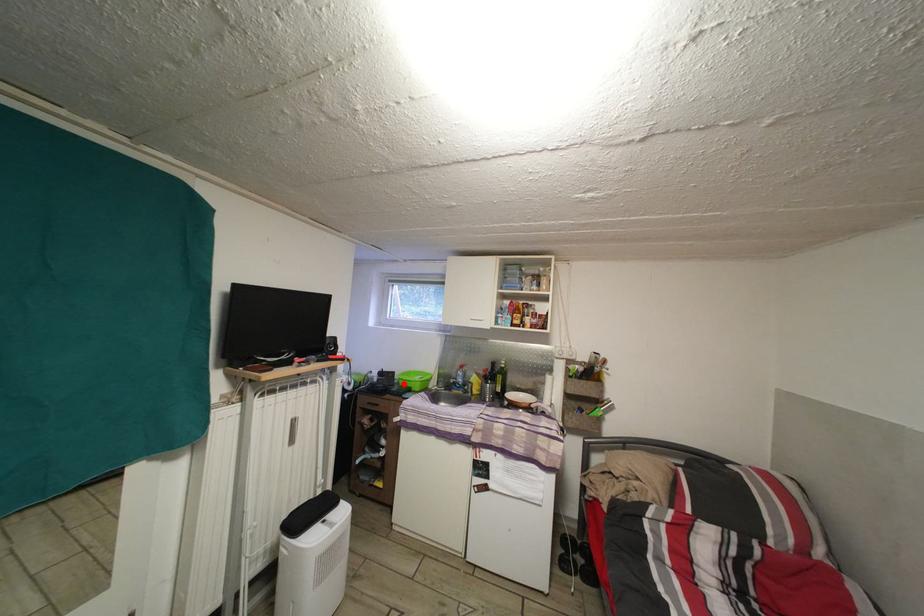
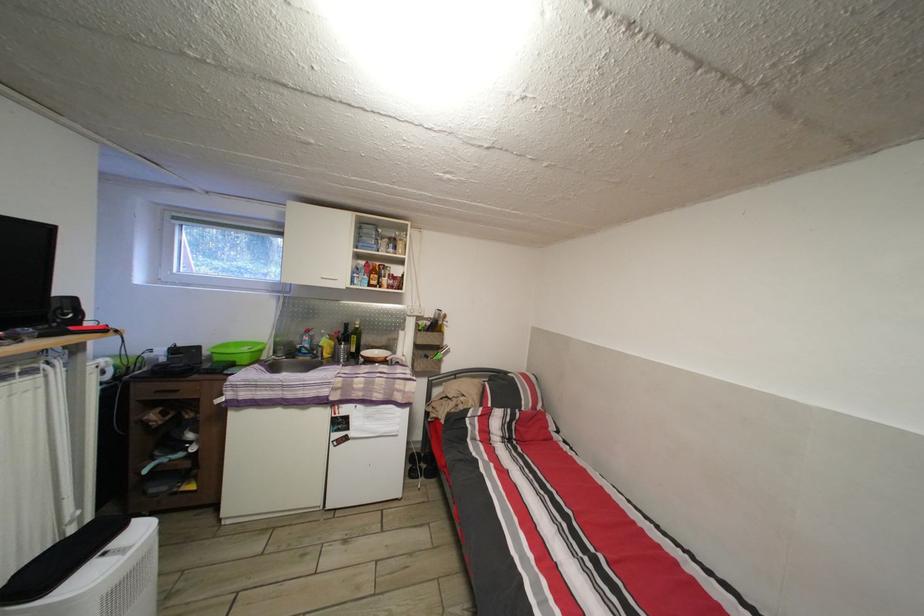
Find the pixel in the second image that matches the highlighted location in the first image.

(213, 359)